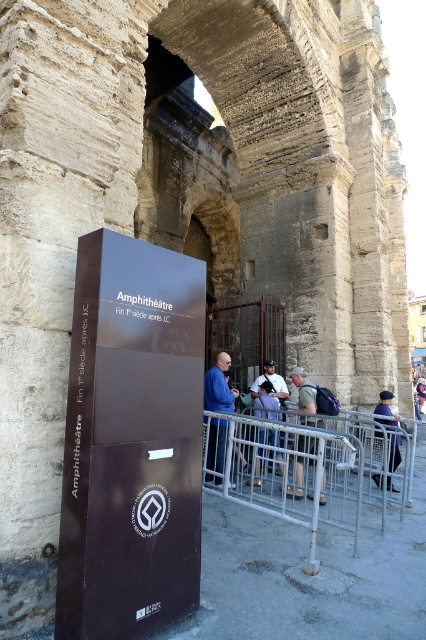
Question: Which point is closer to the camera taking this photo?

Choices:
 (A) (222, 456)
 (B) (271, 360)
 (C) (400, 442)
 (D) (313, 400)

Answer: (A)

Question: Which of these objects is positioned farthest from the blue fabric jacket at center?

Choices:
 (A) silver metallic rail at lower center
 (B) white fabric shirt at center

Answer: (A)

Question: Is blue fabric jacket at center in front of white fabric shirt at center?

Choices:
 (A) no
 (B) yes

Answer: (B)

Question: Can you confirm if silver metallic rail at lower center is positioned above blue fabric jacket at center?

Choices:
 (A) no
 (B) yes

Answer: (A)

Question: Which object is the farthest from the purple fabric bag at lower right?

Choices:
 (A) silver metallic rail at lower center
 (B) white fabric shirt at center
 (C) khaki cotton shirt at center
 (D) blue fabric jacket at center

Answer: (D)

Question: Does purple fabric bag at lower right appear over white fabric shirt at center?

Choices:
 (A) yes
 (B) no

Answer: (B)